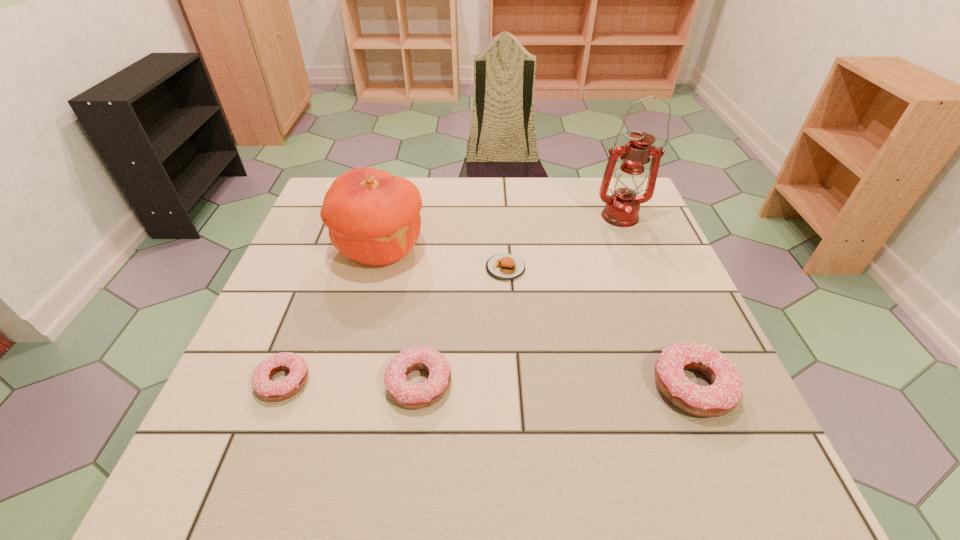
You are a GUI agent. You are given a task and a screenshot of the screen. Output one action in this format:
    pyautogui.click(x=<x>, y=<y>)
    Task: Click on the vacant space located 0.360m on the back of the third tallest object
    
    Given the screenshot: What is the action you would take?
    pyautogui.click(x=635, y=243)

Locate an element on the screen. vacant space located 0.130m on the back of the tallest object is located at coordinates [x=606, y=183].

Where is `vacant space located on the right of the pumpkin`? The width and height of the screenshot is (960, 540). vacant space located on the right of the pumpkin is located at coordinates [x=547, y=248].

Find the location of a particular element. The width and height of the screenshot is (960, 540). blank space located 0.240m on the right of the food is located at coordinates (623, 268).

The height and width of the screenshot is (540, 960). Identify the location of oil lamp present at the far edge. (622, 208).

I want to click on pumpkin present at the far edge, so click(373, 217).

Locate an element on the screen. doughnut present at the left edge is located at coordinates tap(264, 388).

Identify the location of pumpkin located at the left edge. This screenshot has width=960, height=540. (373, 217).

The image size is (960, 540). What are the coordinates of `doughnut positioned at the right edge` in the screenshot? It's located at (722, 396).

At what (x,y) coordinates should I click in order to perform the action: click on oil lamp at the right edge. Please return your answer as a coordinate pair (x, y). The width and height of the screenshot is (960, 540). Looking at the image, I should click on (622, 208).